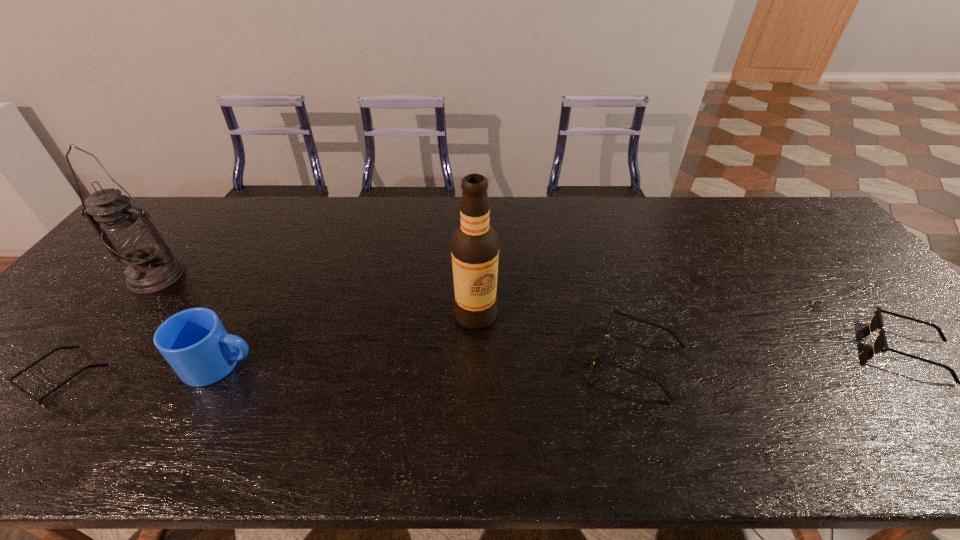
The width and height of the screenshot is (960, 540). What are the coordinates of `the second object from right to left` in the screenshot? It's located at (661, 385).

I want to click on the third object from right to left, so click(x=475, y=244).

Where is `oil lamp`? oil lamp is located at coordinates (127, 233).

Identify the location of mug. This screenshot has width=960, height=540. (194, 342).

The image size is (960, 540). In order to click on the fourth shortest object in this screenshot , I will do `click(194, 342)`.

Identify the location of vacant space positioned 0.340m on the lenses of the second object from right to left. (444, 359).

Locate an element on the screen. The image size is (960, 540). blank area located 0.350m on the lenses of the second object from right to left is located at coordinates (440, 359).

Identify the location of vacant space located on the lenses of the second object from right to left. This screenshot has width=960, height=540. (536, 359).

I want to click on free space located 0.190m on the label of the fourth object from left to right, so click(475, 398).

Where is `vacant area situated on the left of the oil lamp`? The height and width of the screenshot is (540, 960). vacant area situated on the left of the oil lamp is located at coordinates (92, 276).